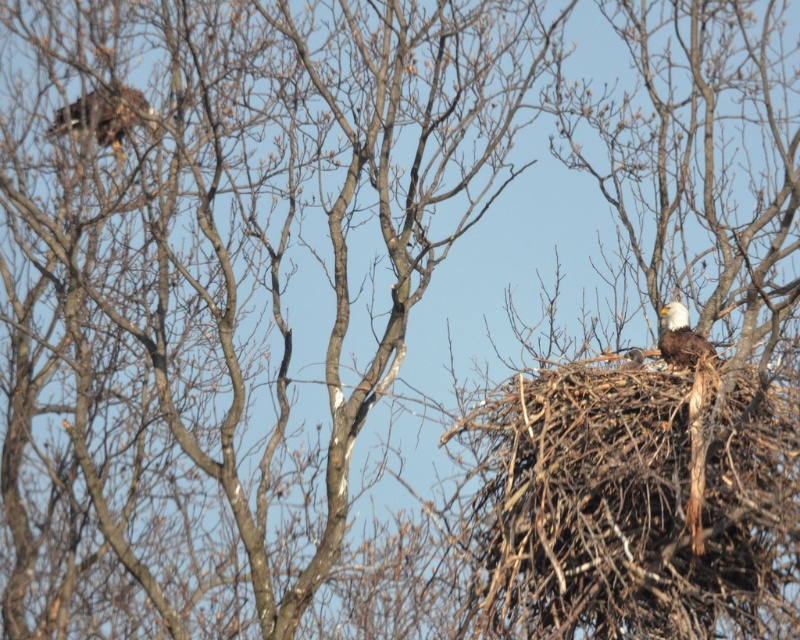
Where is `brown textured eagle at upper left`? brown textured eagle at upper left is located at coordinates (104, 115).

Between point (100, 90) and point (641, 353), which one is positioned in front?

Positioned in front is point (641, 353).

I want to click on brown textured eagle at upper left, so click(104, 115).

Does brown textured eagle at upper left appear on the right side of matte brown eagle at center?

No, brown textured eagle at upper left is not to the right of matte brown eagle at center.

Is point (121, 150) farther from viewer compared to point (686, 340)?

That is True.

The width and height of the screenshot is (800, 640). What are the coordinates of `brown textured eagle at upper left` in the screenshot? It's located at (104, 115).

Who is shorter, matte brown eagle at center or brown feathered eagle at upper right?

brown feathered eagle at upper right is shorter.

Who is more forward, (688, 324) or (638, 356)?

Point (638, 356) is more forward.

At what (x,y) coordinates should I click in order to perform the action: click on matte brown eagle at center. Please return your answer as a coordinate pair (x, y). Looking at the image, I should click on (682, 339).